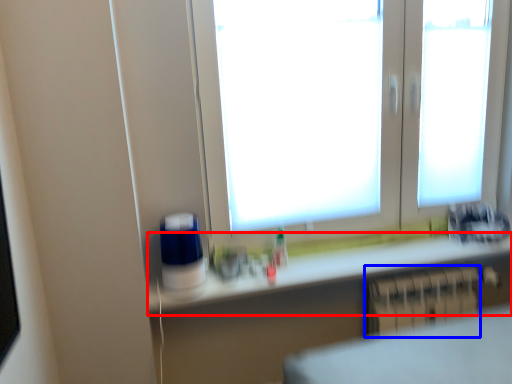
Question: Among these objects, which one is nearest to the camera, counter top (highlighted by a red box) or radiator (highlighted by a blue box)?

Choices:
 (A) counter top
 (B) radiator

Answer: (A)